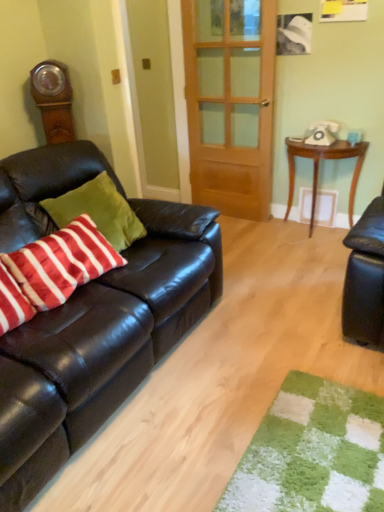
Where is `free space that is to the left of wooden table at right`? The height and width of the screenshot is (512, 384). free space that is to the left of wooden table at right is located at coordinates (259, 240).